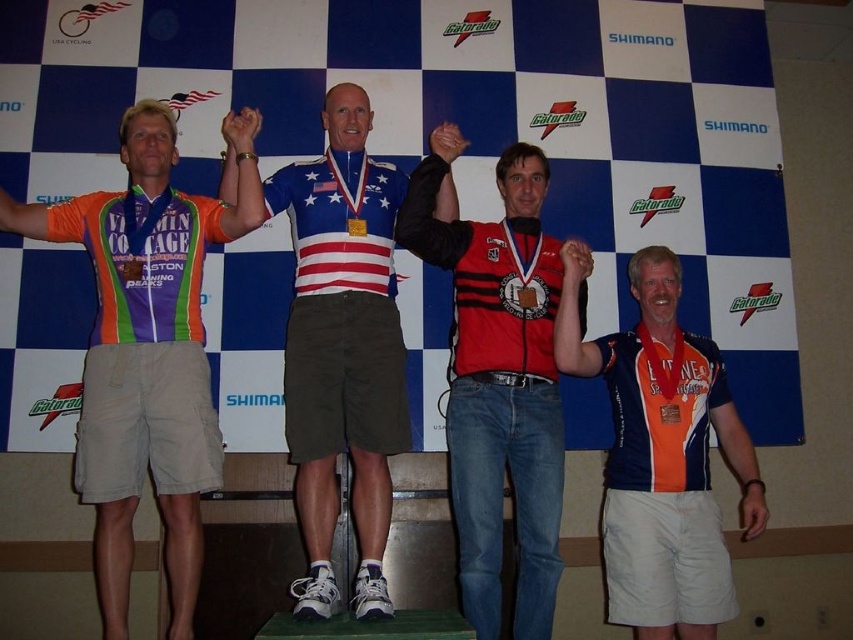
You are a photographer standing behind the podium. You want to take a photo that includes both the matte jersey at center and the matte orange jersey at right. The camera you are using has a maximum focus range of 1.5 meters. Will you be able to capture both subjects in focus?

The distance between the matte jersey at center and the matte orange jersey at right is 1.51 meters. Since the camera can only focus within 1.5 meters, the subjects are slightly out of the focus range. Therefore, both cannot be captured in focus simultaneously.

You are a photographer standing 10 feet away from the podium. You want to capture a photo of both the matte jersey at center and the american flag jersey at center in the same frame. Given that your camera has a maximum focal length that allows capturing objects within a 15 inch distance apart, will you be able to include both in the frame?

The distance between the matte jersey at center and the american flag jersey at center is 16.01 inches, which exceeds the camera maximum focal length of 15 inches. Therefore, you cannot capture both in the same frame.

You are a photographer positioned in front of the podium. You need to capture a photo where both the matte jersey at center and the american flag jersey at center are clearly visible. Given their heights, which jersey should you focus on to ensure both are in frame without adjusting your camera angle?

The matte jersey at center is taller than the american flag jersey at center. Focus on the matte jersey at center to ensure both are in frame since it is taller, allowing the shorter american flag jersey at center to remain within the camera view.